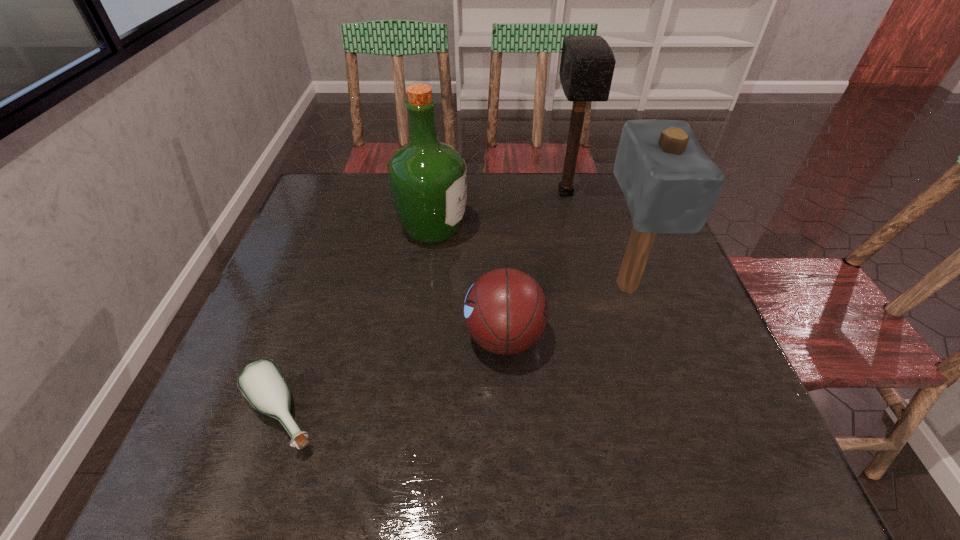
At what (x,y) coordinates should I click in order to perform the action: click on vacant area that lies between the bottle and the fourth tallest object. Please return your answer as a coordinate pair (x, y). This screenshot has height=540, width=960. Looking at the image, I should click on (393, 375).

You are a GUI agent. You are given a task and a screenshot of the screen. Output one action in this format:
    pyautogui.click(x=<x>, y=<y>)
    Task: Click on the free area in between the fourth tallest object and the liquor
    The height and width of the screenshot is (540, 960).
    Given the screenshot: What is the action you would take?
    pyautogui.click(x=468, y=283)

Choose which object is the second nearest neighbor to the fourth tallest object. Please provide its 2D coordinates. Your answer should be formatted as a tuple, i.e. [(x, y)], where the tuple contains the x and y coordinates of a point satisfying the conditions above.

[(428, 179)]

Where is `object that is the closest to the liquor`? object that is the closest to the liquor is located at coordinates (505, 311).

The image size is (960, 540). Find the location of `free point that satisfies the following two spatial constraints: 1. on the front side of the nearer mallet; 2. on the right side of the farther mallet`. free point that satisfies the following two spatial constraints: 1. on the front side of the nearer mallet; 2. on the right side of the farther mallet is located at coordinates pyautogui.click(x=588, y=285).

Locate an element on the screen. Image resolution: width=960 pixels, height=540 pixels. free spot that satisfies the following two spatial constraints: 1. on the front-facing side of the basketball; 2. on the left side of the liquor is located at coordinates (420, 337).

Where is `vacant space that satisfies the following two spatial constraints: 1. on the back side of the farther mallet; 2. on the right side of the fourth tallest object`? This screenshot has width=960, height=540. vacant space that satisfies the following two spatial constraints: 1. on the back side of the farther mallet; 2. on the right side of the fourth tallest object is located at coordinates (497, 193).

I want to click on vacant space that satisfies the following two spatial constraints: 1. on the back side of the nearer mallet; 2. on the front-facing side of the liquor, so click(x=608, y=230).

You are a GUI agent. You are given a task and a screenshot of the screen. Output one action in this format:
    pyautogui.click(x=<x>, y=<y>)
    Task: Click on the vacant region that satisfies the following two spatial constraints: 1. on the back side of the farther mallet; 2. on the right side of the nearest object
    This screenshot has width=960, height=540.
    Given the screenshot: What is the action you would take?
    pyautogui.click(x=357, y=193)